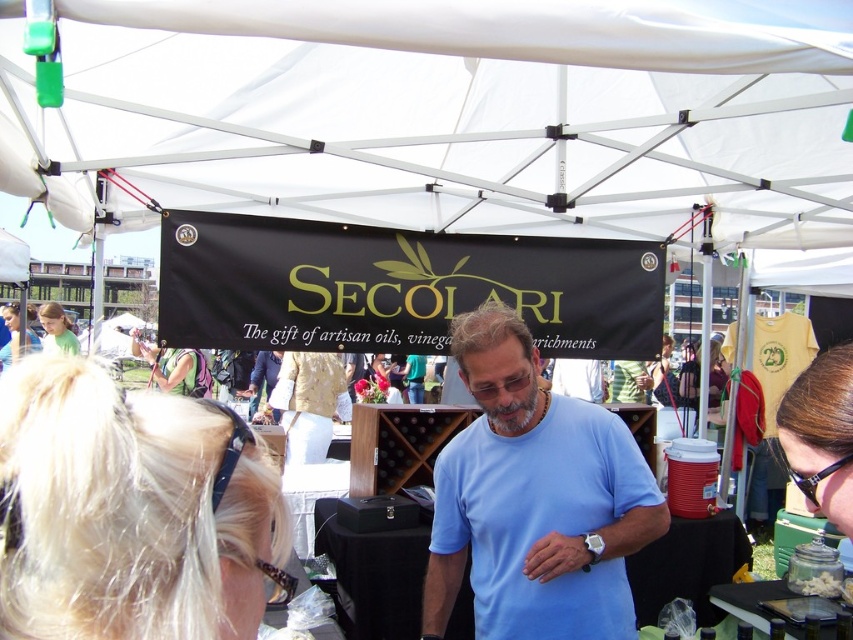
Who is more forward, (465, 436) or (381, 356)?

Point (465, 436)

Can you confirm if blue cotton shirt at center is thinner than matte black hair at center?

In fact, blue cotton shirt at center might be wider than matte black hair at center.

What do you see at coordinates (534, 500) in the screenshot? I see `blue cotton shirt at center` at bounding box center [534, 500].

Where is `blue cotton shirt at center`? blue cotton shirt at center is located at coordinates pyautogui.click(x=534, y=500).

Is sunglasses at upper right further to camera compared to green fabric backpack at lower left?

No, sunglasses at upper right is in front of green fabric backpack at lower left.

Is sunglasses at upper right to the left of green fabric backpack at lower left from the viewer's perspective?

Incorrect, sunglasses at upper right is not on the left side of green fabric backpack at lower left.

Find the location of a particular element. This screenshot has height=640, width=853. sunglasses at upper right is located at coordinates (821, 435).

Describe the element at coordinates (451, 113) in the screenshot. Image resolution: width=853 pixels, height=640 pixels. I see `white fabric canopy at upper center` at that location.

Does white fabric canopy at upper center have a lesser width compared to matte black hair at center?

No.

I want to click on white fabric canopy at upper center, so click(x=451, y=113).